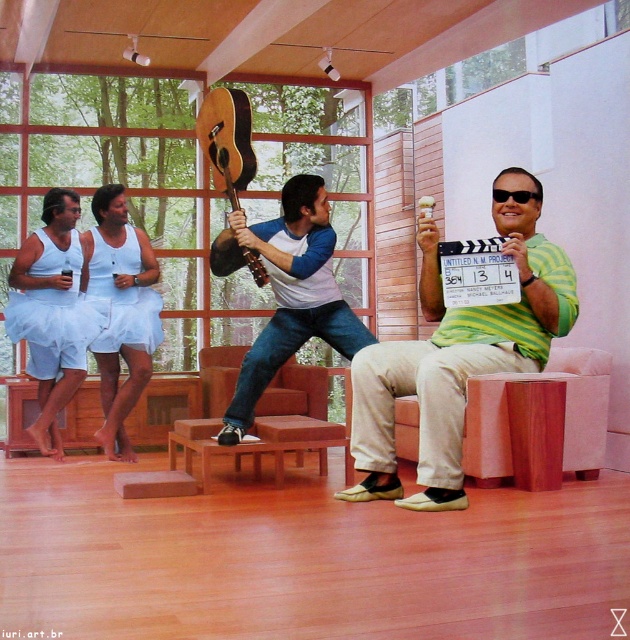
You are a photographer planning to take a photo of the green striped shirt at center and the white fabric skirt at left. Which object should you focus on first if you want to ensure both are in sharp focus?

The green striped shirt at center is positioned under the white fabric skirt at left, so you should focus on the white fabric skirt at left first to ensure both are in sharp focus.

You are a photographer positioned at the center of the room. You want to capture a photo that includes both the green striped shirt at center and the white fabric skirt at left. What is the minimum distance you need to move backward to ensure both subjects are in frame?

To include both the green striped shirt at center and the white fabric skirt at left, you need to move backward at least 7.15 feet from your current position at the center.